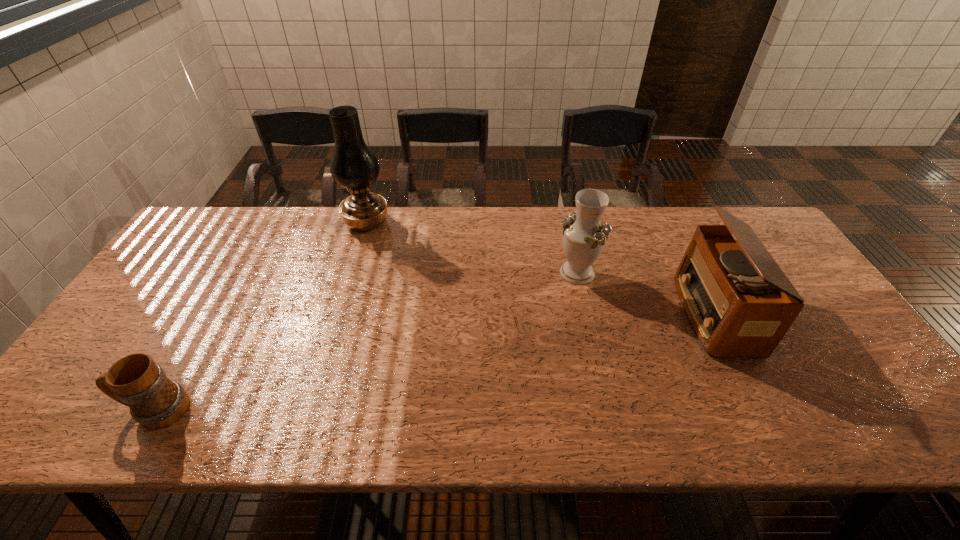
The height and width of the screenshot is (540, 960). In order to click on the farthest object in this screenshot , I will do `click(353, 166)`.

Identify the location of the third object from right to left. (353, 166).

The width and height of the screenshot is (960, 540). Find the location of `vase`. vase is located at coordinates (584, 237).

The height and width of the screenshot is (540, 960). What are the coordinates of `the rightmost object` in the screenshot? It's located at (739, 302).

Identify the location of the nearest object. Image resolution: width=960 pixels, height=540 pixels. coord(156,402).

At what (x,y) coordinates should I click in order to perform the action: click on mug. Please return your answer as a coordinate pair (x, y). This screenshot has width=960, height=540. Looking at the image, I should click on (156, 402).

Identify the location of vacant space positioned on the front of the third object from right to left. The width and height of the screenshot is (960, 540). (334, 328).

Identify the location of free spot located on the front of the third object from left to right. (586, 309).

Identify the location of free space located 0.340m on the front panel of the rightmost object. (557, 314).

Where is `vacant space located on the front panel of the rightmost object`? The height and width of the screenshot is (540, 960). vacant space located on the front panel of the rightmost object is located at coordinates (546, 314).